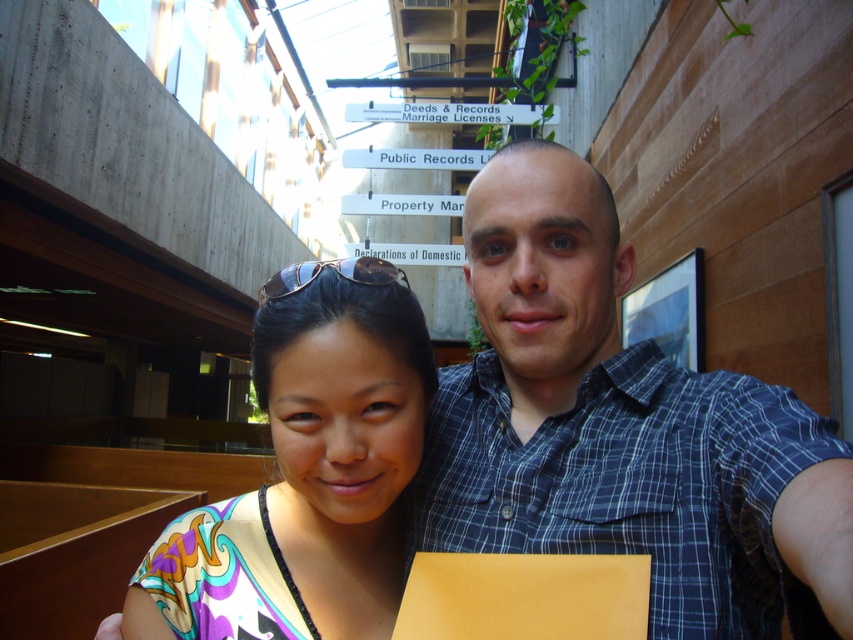
Is blue plaid shirt at center positioned in front of black plastic sunglasses at upper center?

Yes, blue plaid shirt at center is closer to the viewer.

Does blue plaid shirt at center have a greater width compared to black plastic sunglasses at upper center?

Correct, the width of blue plaid shirt at center exceeds that of black plastic sunglasses at upper center.

Where is `blue plaid shirt at center`? blue plaid shirt at center is located at coordinates (622, 429).

The image size is (853, 640). What do you see at coordinates (622, 429) in the screenshot? I see `blue plaid shirt at center` at bounding box center [622, 429].

Locate an element on the screen. The image size is (853, 640). blue plaid shirt at center is located at coordinates (622, 429).

Between multicolored fabric at center and black plastic sunglasses at upper center, which one appears on the left side from the viewer's perspective?

Positioned to the left is black plastic sunglasses at upper center.

Between point (381, 576) and point (343, 262), which one is positioned in front?

Point (343, 262) is in front.

The width and height of the screenshot is (853, 640). What do you see at coordinates (311, 468) in the screenshot?
I see `multicolored fabric at center` at bounding box center [311, 468].

At what (x,y) coordinates should I click in order to perform the action: click on multicolored fabric at center. Please return your answer as a coordinate pair (x, y). Looking at the image, I should click on [311, 468].